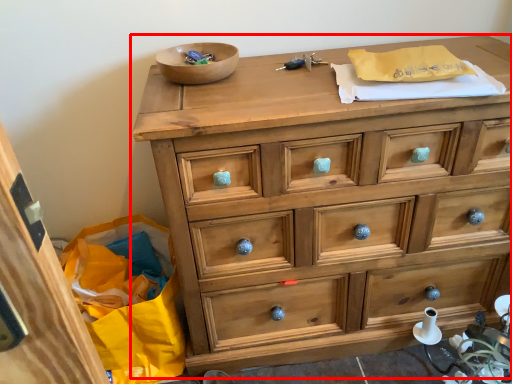
Question: Where is chest of drawers (annotated by the red box) located in relation to bowl in the image?

Choices:
 (A) right
 (B) left

Answer: (A)